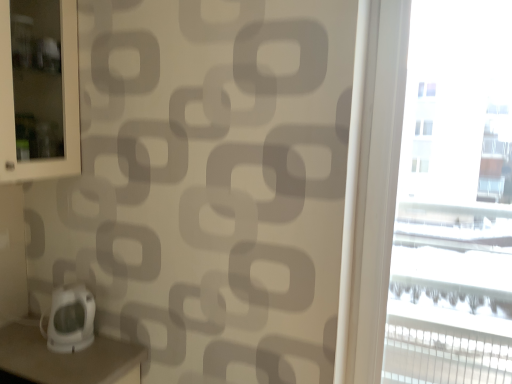
Describe the element at coordinates (454, 200) in the screenshot. I see `transparent glass window at right` at that location.

Identify the location of transparent glass window at right. Image resolution: width=512 pixels, height=384 pixels. (454, 200).

Describe the element at coordinates (70, 319) in the screenshot. I see `white glossy scale at lower left` at that location.

Find the location of a particular element. The width and height of the screenshot is (512, 384). white glossy scale at lower left is located at coordinates (70, 319).

Measure the distance between point (x=54, y=342) and camera.

1.45 meters.

Locate an element on the screen. This screenshot has width=512, height=384. transparent glass window at right is located at coordinates (454, 200).

Which is more to the left, white glossy scale at lower left or transparent glass window at right?

white glossy scale at lower left is more to the left.

Which object is closer to the camera, white glossy scale at lower left or transparent glass window at right?

transparent glass window at right is in front.

Between point (66, 348) and point (486, 136), which one is positioned in front?

The point (486, 136) is closer to the camera.

From the image's perspective, which is above, white glossy scale at lower left or transparent glass window at right?

transparent glass window at right.

From a real-world perspective, is white glossy scale at lower left over transparent glass window at right?

Actually, white glossy scale at lower left is physically below transparent glass window at right in the real world.

Consider the image. Is white glossy scale at lower left wider than transparent glass window at right?

Yes, white glossy scale at lower left is wider than transparent glass window at right.

Considering the sizes of objects white glossy scale at lower left and transparent glass window at right in the image provided, who is taller, white glossy scale at lower left or transparent glass window at right?

transparent glass window at right is taller.

Based on the photo, can you confirm if white glossy scale at lower left is smaller than transparent glass window at right?

Correct, white glossy scale at lower left occupies less space than transparent glass window at right.

Is white glossy scale at lower left located outside transparent glass window at right?

Yes.

Is white glossy scale at lower left not near transparent glass window at right?

white glossy scale at lower left is positioned a significant distance from transparent glass window at right.

Does white glossy scale at lower left turn towards transparent glass window at right?

Yes, white glossy scale at lower left faces towards transparent glass window at right.

How different are the orientations of white glossy scale at lower left and transparent glass window at right in degrees?

white glossy scale at lower left and transparent glass window at right are facing 91 degrees away from each other.

Measure the distance from white glossy scale at lower left to transparent glass window at right.

white glossy scale at lower left is 1.44 meters from transparent glass window at right.

The height and width of the screenshot is (384, 512). In the image, there is a transparent glass window at right. What are the coordinates of `appliance below it (from the image's perspective)` in the screenshot? It's located at (70, 319).

In the scene shown: Which is more to the left, transparent glass window at right or white glossy scale at lower left?

Positioned to the left is white glossy scale at lower left.

Is the position of transparent glass window at right more distant than that of white glossy scale at lower left?

No, the depth of transparent glass window at right is less than that of white glossy scale at lower left.

Which is in front, point (384, 376) or point (66, 340)?

Positioned in front is point (66, 340).

From the image's perspective, between transparent glass window at right and white glossy scale at lower left, which one is located above?

transparent glass window at right is shown above in the image.

From a real-world perspective, is transparent glass window at right positioned above or below white glossy scale at lower left?

From a real-world perspective, transparent glass window at right is physically above white glossy scale at lower left.

Is transparent glass window at right thinner than white glossy scale at lower left?

Yes.

In the scene shown: Can you confirm if transparent glass window at right is taller than white glossy scale at lower left?

Yes, transparent glass window at right is taller than white glossy scale at lower left.

Considering the sizes of objects transparent glass window at right and white glossy scale at lower left in the image provided, who is smaller, transparent glass window at right or white glossy scale at lower left?

Smaller between the two is white glossy scale at lower left.

Is transparent glass window at right inside the boundaries of white glossy scale at lower left, or outside?

transparent glass window at right exists outside the volume of white glossy scale at lower left.

Would you say transparent glass window at right is a long distance from white glossy scale at lower left?

Yes, transparent glass window at right and white glossy scale at lower left are quite far apart.

Could you tell me if transparent glass window at right is turned towards white glossy scale at lower left?

No, transparent glass window at right is not aimed at white glossy scale at lower left.

Can you tell me how much transparent glass window at right and white glossy scale at lower left differ in facing direction?

91 degrees.

Identify the location of window that appears above the white glossy scale at lower left (from the image's perspective). (454, 200).

In order to click on window located above the white glossy scale at lower left (from the image's perspective) in this screenshot , I will do `click(454, 200)`.

Image resolution: width=512 pixels, height=384 pixels. Identify the location of appliance behind the transparent glass window at right. (70, 319).